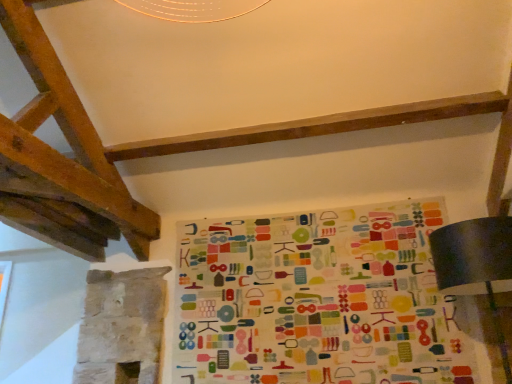
Question: Considering the positions of matte black lampshade at lower right and multicolored fabric at center in the image, is matte black lampshade at lower right bigger or smaller than multicolored fabric at center?

Choices:
 (A) big
 (B) small

Answer: (A)

Question: From the image's perspective, is matte black lampshade at lower right above or below multicolored fabric at center?

Choices:
 (A) below
 (B) above

Answer: (B)

Question: Looking at their shapes, would you say matte black lampshade at lower right is wider or thinner than multicolored fabric at center?

Choices:
 (A) wide
 (B) thin

Answer: (A)

Question: Considering the positions of multicolored fabric at center and matte black lampshade at lower right in the image, is multicolored fabric at center bigger or smaller than matte black lampshade at lower right?

Choices:
 (A) small
 (B) big

Answer: (A)

Question: Visually, is multicolored fabric at center positioned to the left or to the right of matte black lampshade at lower right?

Choices:
 (A) left
 (B) right

Answer: (A)

Question: Considering the positions of point (417, 221) and point (489, 254), is point (417, 221) closer or farther from the camera than point (489, 254)?

Choices:
 (A) closer
 (B) farther

Answer: (B)

Question: From a real-world perspective, relative to matte black lampshade at lower right, is multicolored fabric at center vertically above or below?

Choices:
 (A) above
 (B) below

Answer: (A)